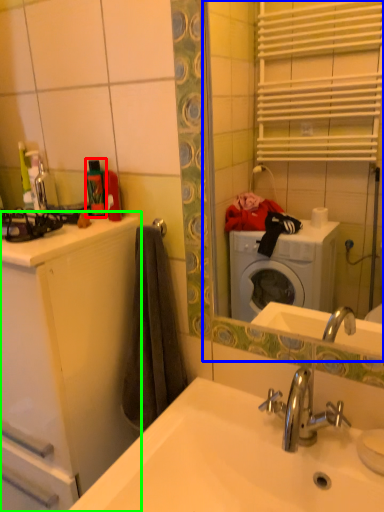
Question: Based on their relative distances, which object is farther from toiletry (highlighted by a red box)? Choose from mirror (highlighted by a blue box) and bathroom cabinet (highlighted by a green box).

Choices:
 (A) mirror
 (B) bathroom cabinet

Answer: (A)